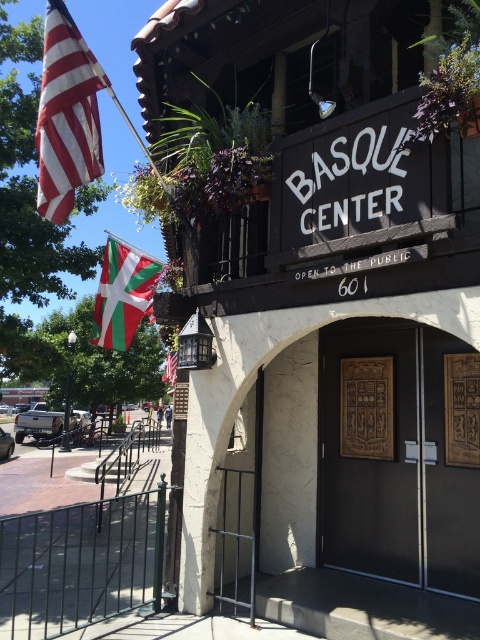
Who is more distant from viewer, (145,67) or (73,106)?

Positioned behind is point (145,67).

I want to click on wooden sign at upper center, so click(331, 314).

Image resolution: width=480 pixels, height=640 pixels. What do you see at coordinates (371, 451) in the screenshot? I see `wooden door at center` at bounding box center [371, 451].

Between wooden door at center and green and white fabric flag at left, which one appears on the right side from the viewer's perspective?

wooden door at center

Which is in front, point (384, 502) or point (159, 269)?

Point (384, 502)

The height and width of the screenshot is (640, 480). I want to click on wooden door at center, so click(371, 451).

Who is more forward, (54, 170) or (131, 275)?

Positioned in front is point (54, 170).

Looking at this image, is red-white striped flag at upper left above green and white fabric flag at left?

Correct, red-white striped flag at upper left is located above green and white fabric flag at left.

Describe the element at coordinates (67, 115) in the screenshot. The width and height of the screenshot is (480, 640). I see `red-white striped flag at upper left` at that location.

Where is `red-white striped flag at upper left`? red-white striped flag at upper left is located at coordinates (67, 115).